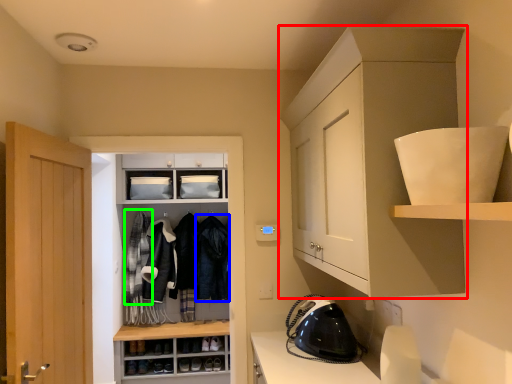
Question: Which object is positioned farthest from cabinetry (highlighted by a red box)? Select from clothing (highlighted by a blue box) and clothing (highlighted by a green box).

Choices:
 (A) clothing
 (B) clothing

Answer: (B)